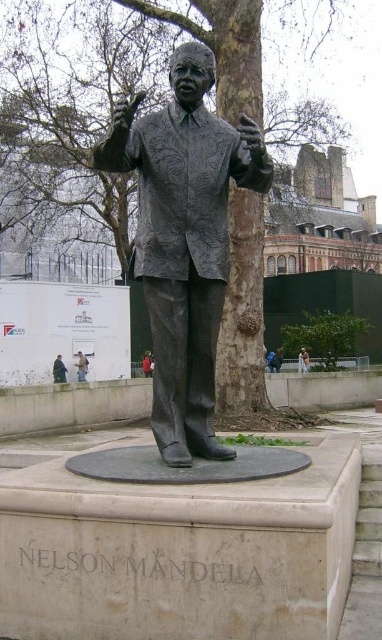
You are standing in the public square and want to take a photo of the bronze statue at center. To ensure the statue is centered in your photo, where should you position yourself relative to the statue?

The bronze statue at center is located at the coordinates 0.377 on the x axis and 0.484 on the y axis, so you should position yourself directly in front of it to center it in your photo.

You are a visitor in the park and want to take a photo of the bronze statue at center without the green leafy tree at center blocking it. Which direction should you move to ensure the tree is out of frame?

The bronze statue at center is not as tall as the green leafy tree at center, so moving to the side of the statue away from the tree would allow you to position yourself where the tree is no longer blocking the view.

You are a visitor at the park and want to take a photo of the bronze statue of Nelson Mandela. However, you notice two trees in front of the statue. Which tree, the brown textured tree at center or the green leafy tree at center, is wider and might block your view more?

The brown textured tree at center is wider than the green leafy tree at center, so it might block your view more.